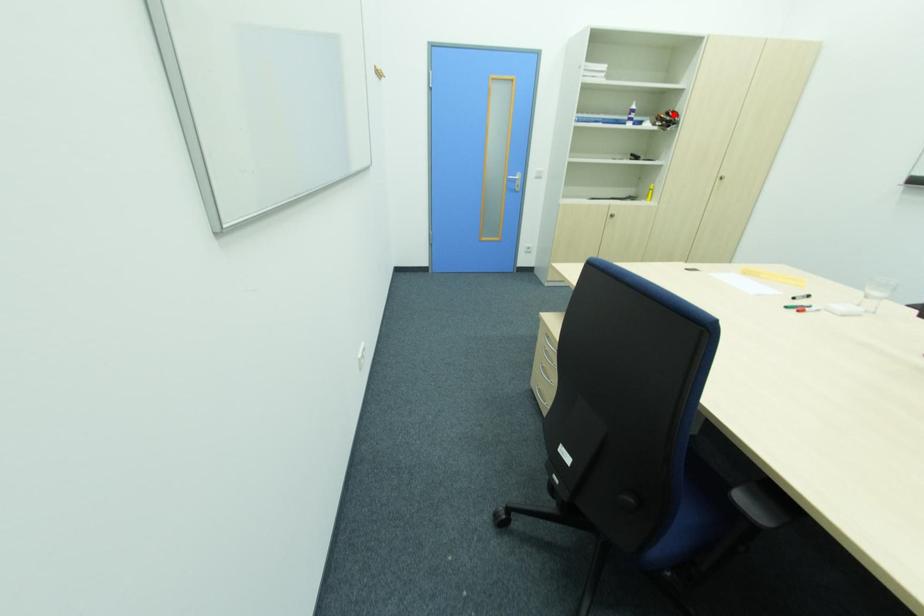
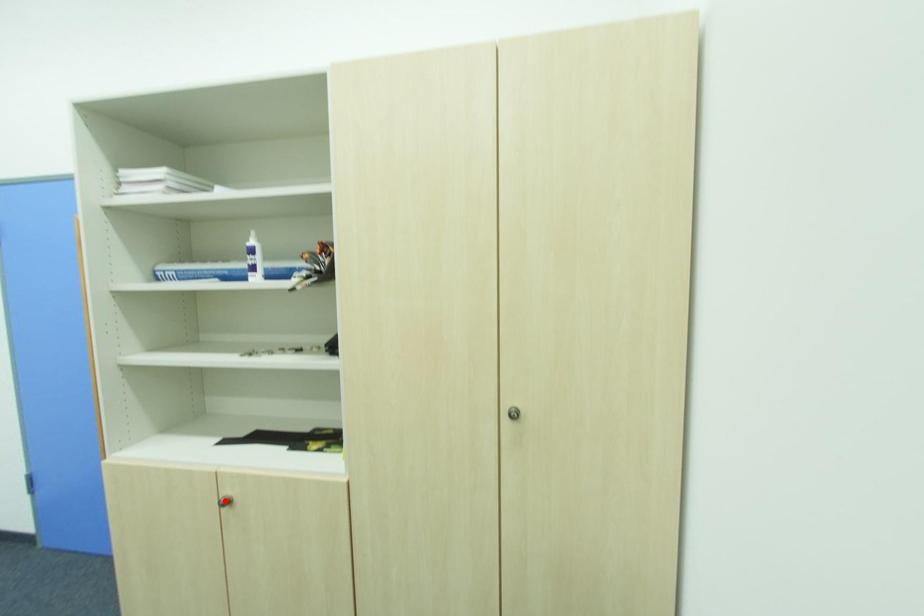
I am providing you with two images of the same scene from different viewpoints. A red point is marked on the first image and another point is marked on the second image. Is the marked point in image1 the same physical position as the marked point in image2?

No